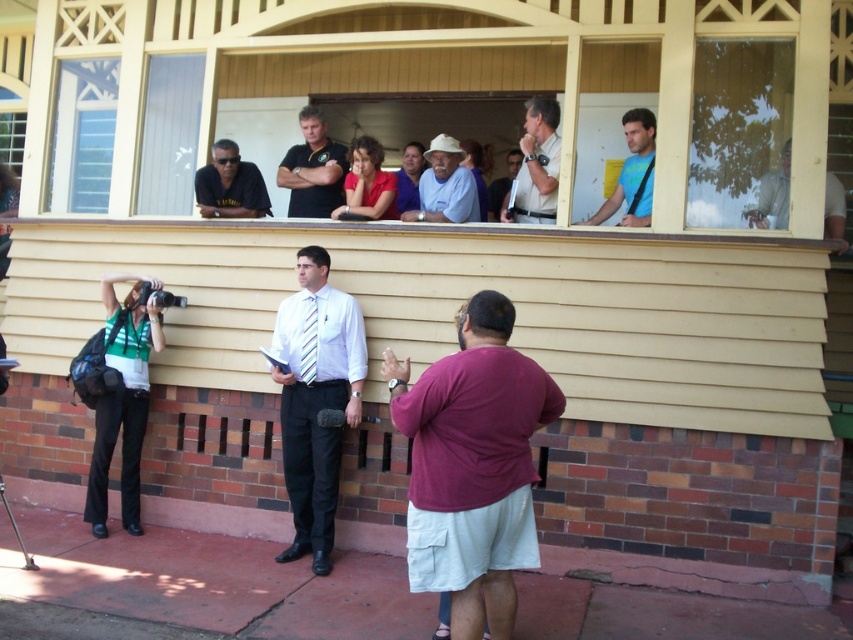
Question: Is white glossy shirt at center above matte black polo shirt at center?

Choices:
 (A) yes
 (B) no

Answer: (B)

Question: Which object is farther from the camera taking this photo?

Choices:
 (A) green striped shirt at left
 (B) light brown wood at upper right
 (C) matte blue shirt at center

Answer: (C)

Question: Which point is closer to the camera?

Choices:
 (A) green striped shirt at left
 (B) matte black polo shirt at center

Answer: (A)

Question: Which object is farther from the camera taking this photo?

Choices:
 (A) light blue t-shirt at upper center
 (B) blue cotton shirt at center

Answer: (B)

Question: Does light brown leather jacket at upper center have a larger size compared to matte black shirt at upper center?

Choices:
 (A) no
 (B) yes

Answer: (B)

Question: Is green striped shirt at left behind light brown wood at upper right?

Choices:
 (A) yes
 (B) no

Answer: (A)